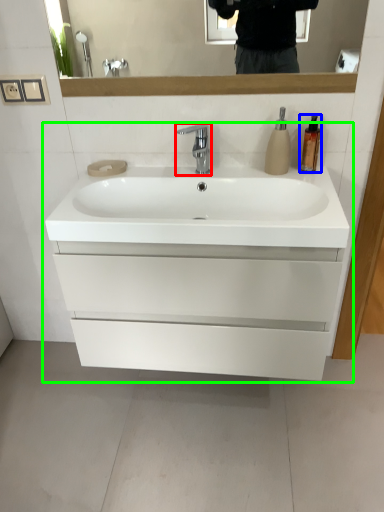
Question: Estimate the real-world distances between objects in this image. Which object is farther from tap (highlighted by a red box), soap dispenser (highlighted by a blue box) or bathroom cabinet (highlighted by a green box)?

Choices:
 (A) soap dispenser
 (B) bathroom cabinet

Answer: (B)